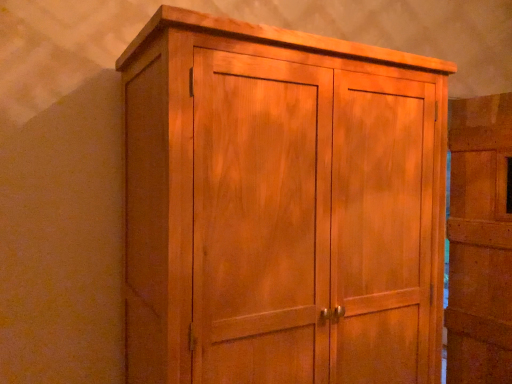
Question: Is light brown wood cupboard at center wider than matte wood door at right?

Choices:
 (A) yes
 (B) no

Answer: (A)

Question: Is light brown wood cupboard at center at the right side of matte wood door at right?

Choices:
 (A) yes
 (B) no

Answer: (B)

Question: From the image's perspective, does light brown wood cupboard at center appear lower than matte wood door at right?

Choices:
 (A) no
 (B) yes

Answer: (A)

Question: From a real-world perspective, is light brown wood cupboard at center below matte wood door at right?

Choices:
 (A) yes
 (B) no

Answer: (B)

Question: From the image's perspective, is light brown wood cupboard at center above matte wood door at right?

Choices:
 (A) yes
 (B) no

Answer: (A)

Question: Is light brown wood cupboard at center facing away from matte wood door at right?

Choices:
 (A) yes
 (B) no

Answer: (B)

Question: Is the surface of matte wood door at right in direct contact with light brown wood cupboard at center?

Choices:
 (A) no
 (B) yes

Answer: (A)

Question: Can you confirm if matte wood door at right is wider than light brown wood cupboard at center?

Choices:
 (A) no
 (B) yes

Answer: (A)

Question: Is matte wood door at right in front of light brown wood cupboard at center?

Choices:
 (A) no
 (B) yes

Answer: (A)

Question: Is matte wood door at right located outside light brown wood cupboard at center?

Choices:
 (A) yes
 (B) no

Answer: (A)

Question: From the image's perspective, is matte wood door at right over light brown wood cupboard at center?

Choices:
 (A) no
 (B) yes

Answer: (A)

Question: Is matte wood door at right at the left side of light brown wood cupboard at center?

Choices:
 (A) yes
 (B) no

Answer: (B)

Question: Is matte wood door at right taller or shorter than light brown wood cupboard at center?

Choices:
 (A) short
 (B) tall

Answer: (B)